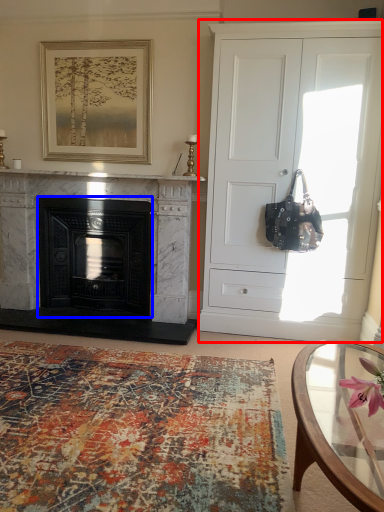
Question: Which point is further to the camera, cabinetry (highlighted by a red box) or fireplace (highlighted by a blue box)?

Choices:
 (A) cabinetry
 (B) fireplace

Answer: (B)